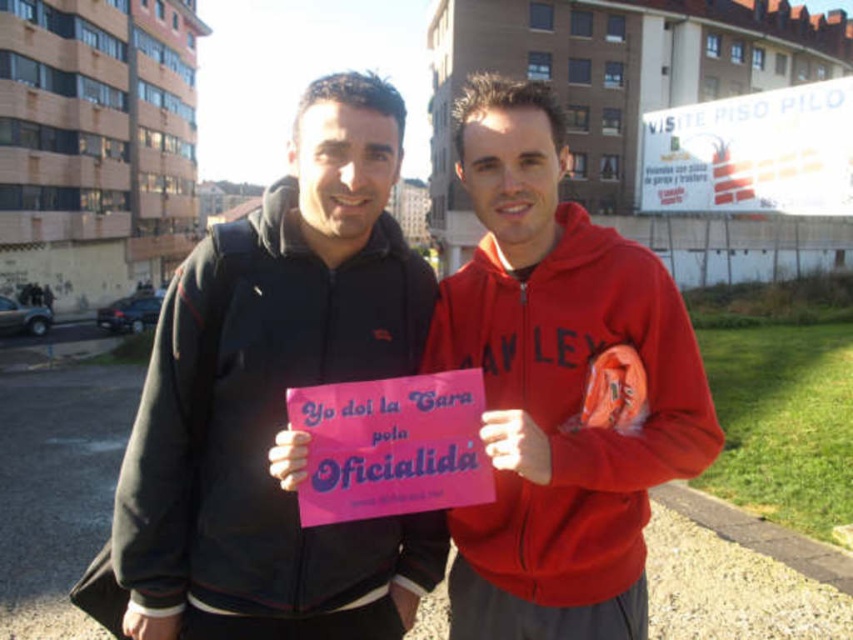
You are a photographer trying to capture the best angle of the two people in the scene. You want to ensure both the pink paper sign at center and the white paper sign at upper right are clearly visible in the photo. Which sign should you focus on first to ensure depth of field captures both?

Focus on the pink paper sign at center first because it is closer to the viewer, ensuring the white paper sign at upper right will be in focus as well due to its position further back.

You are a photographer trying to capture both signs in a single frame. Given that the pink matte sign at center is narrower than the white paper sign at upper right, which sign would require more careful positioning to ensure it fits within the camera frame?

The pink matte sign at center has a lesser width compared to the white paper sign at upper right, so it would require more careful positioning to ensure it fits within the camera frame since it is narrower and might be easier to accidentally exclude from the shot.

You are a photographer standing in front of the two people in the image. You want to take a photo that includes both the pink matte sign at center and the white paper sign at upper right. Which sign will appear larger in the photo?

The pink matte sign at center will appear larger in the photo because it is closer to the viewer than the white paper sign at upper right.